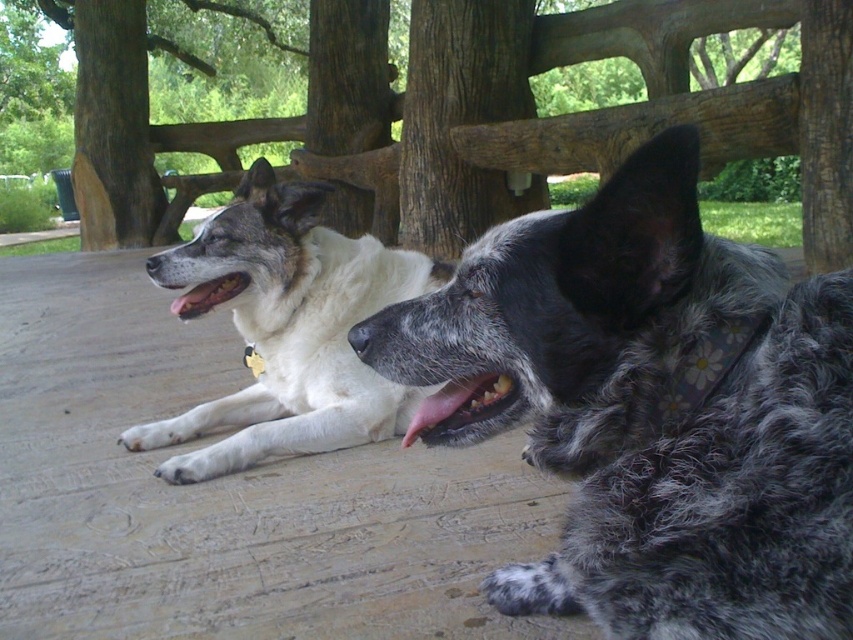
You are a veterinarian examining two dogs. The spotted fur dog at center and the white fur dog at left are both lying on a wooden deck. Based on their appearance, which dog has a smaller body size?

The spotted fur dog at center is thinner than the white fur dog at left, so it has a smaller body size.